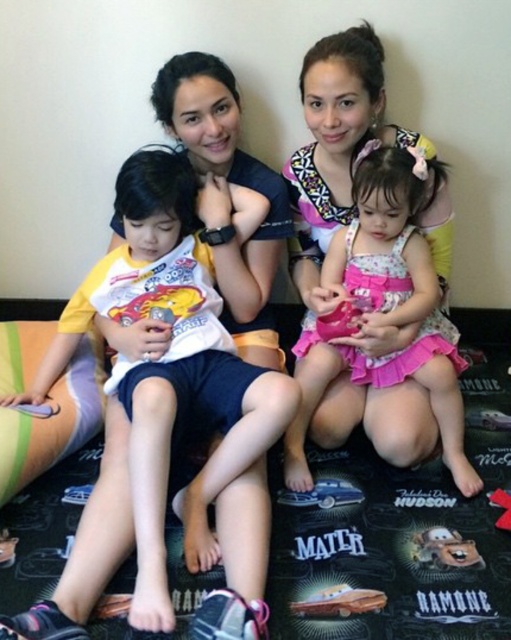
You are a photographer trying to capture a closeup of the metallic gold car at lower center without the brown plush toy at lower right blocking the view. Which direction should you move your camera to achieve this?

Move the camera to the right so that the metallic gold car at lower center is no longer blocked by the brown plush toy at lower right, which is positioned to its right side.

You are standing in front of the family scene on the Cars floor mat. There are two points marked in the image. Which point is closer to you, point [360,490] or point [509,493]?

Point [360,490] is closer to you than point [509,493] because it is further to the viewer according to the description.